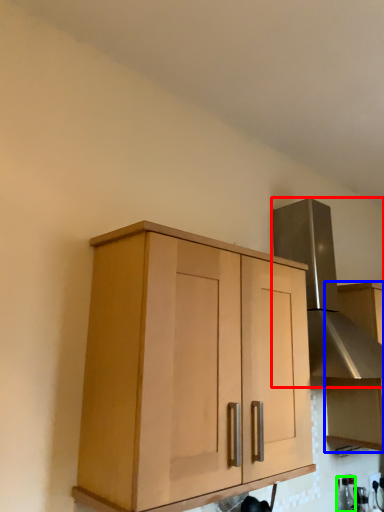
Question: Based on their relative distances, which object is nearer to vent (highlighted by a red box)? Choose from cabinetry (highlighted by a blue box) and bottle (highlighted by a green box).

Choices:
 (A) cabinetry
 (B) bottle

Answer: (A)